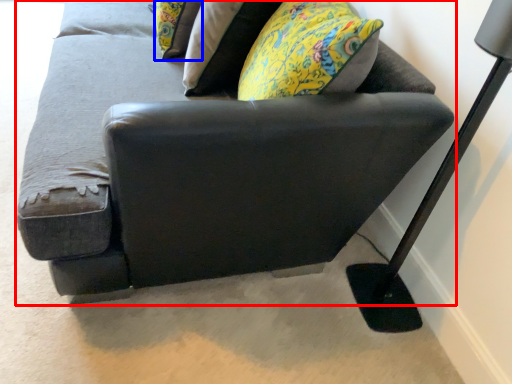
Question: Which object is closer to the camera taking this photo, studio couch (highlighted by a red box) or pillow (highlighted by a blue box)?

Choices:
 (A) studio couch
 (B) pillow

Answer: (A)